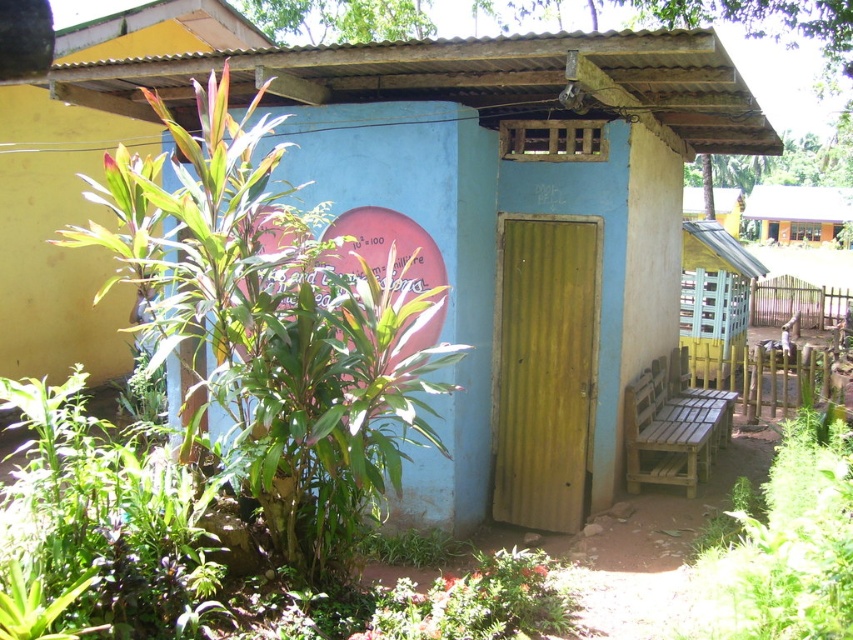
Can you confirm if wooden bench at right is bigger than wooden bench at center?

Yes.

Between wooden bench at right and wooden bench at center, which one is positioned higher?

wooden bench at center

What do you see at coordinates (714, 298) in the screenshot?
I see `wooden bench at right` at bounding box center [714, 298].

Where is `wooden bench at right`? The width and height of the screenshot is (853, 640). wooden bench at right is located at coordinates (714, 298).

From the picture: Can you confirm if green corrugated door at center is positioned to the right of wooden bench at right?

Incorrect, green corrugated door at center is not on the right side of wooden bench at right.

Image resolution: width=853 pixels, height=640 pixels. In order to click on green corrugated door at center in this screenshot , I will do `click(544, 371)`.

Locate an element on the screen. The width and height of the screenshot is (853, 640). green corrugated door at center is located at coordinates (544, 371).

Does green corrugated door at center appear on the left side of wooden bench at center?

Yes, green corrugated door at center is to the left of wooden bench at center.

The image size is (853, 640). What do you see at coordinates (544, 371) in the screenshot?
I see `green corrugated door at center` at bounding box center [544, 371].

Identify the location of green corrugated door at center. (544, 371).